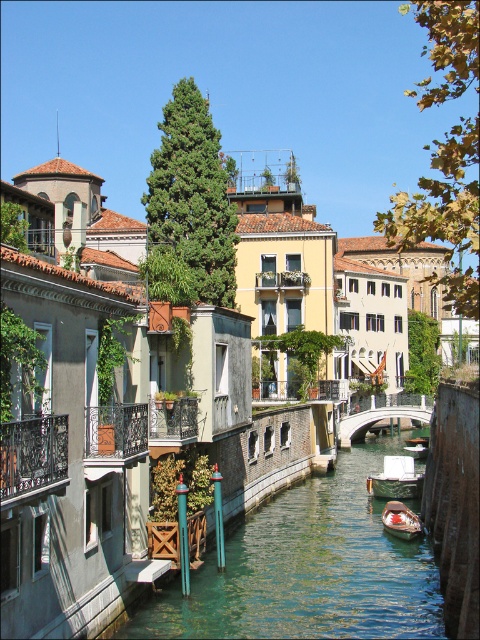
What do you see at coordinates (308, 568) in the screenshot?
I see `greenish water at center` at bounding box center [308, 568].

Between greenish water at center and wooden boat at center, which one is positioned higher?

wooden boat at center is higher up.

Image resolution: width=480 pixels, height=640 pixels. What do you see at coordinates (308, 568) in the screenshot?
I see `greenish water at center` at bounding box center [308, 568].

Identify the location of greenish water at center. (308, 568).

Does white stone bridge at center have a larger size compared to wooden boat at center?

Correct, white stone bridge at center is larger in size than wooden boat at center.

From the picture: Does white stone bridge at center have a lesser height compared to wooden boat at center?

Incorrect, white stone bridge at center's height does not fall short of wooden boat at center's.

What do you see at coordinates (382, 413) in the screenshot? This screenshot has width=480, height=640. I see `white stone bridge at center` at bounding box center [382, 413].

This screenshot has width=480, height=640. Identify the location of white stone bridge at center. (382, 413).

Is greenish water at center to the right of green wooden boat at center from the viewer's perspective?

In fact, greenish water at center is to the left of green wooden boat at center.

Does point (367, 470) lie in front of point (405, 468)?

No, it is behind (405, 468).

Image resolution: width=480 pixels, height=640 pixels. In order to click on greenish water at center in this screenshot , I will do `click(308, 568)`.